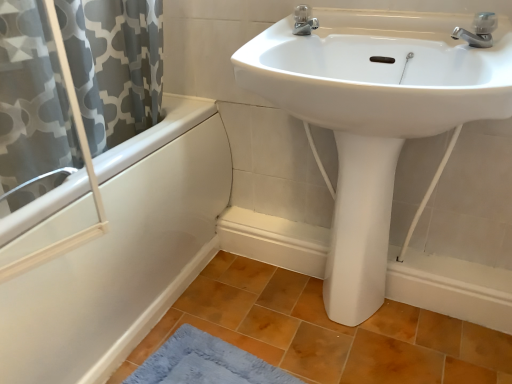
Question: Considering the positions of silver metallic faucet at upper right, which ranks as the 1th tap in front-to-back order, and silver metallic faucet at upper center, placed as the 2th tap when sorted from front to back, in the image, is silver metallic faucet at upper right, which ranks as the 1th tap in front-to-back order, bigger or smaller than silver metallic faucet at upper center, placed as the 2th tap when sorted from front to back,?

Choices:
 (A) big
 (B) small

Answer: (A)

Question: Relative to silver metallic faucet at upper center, the 1th tap when ordered from back to front, is silver metallic faucet at upper right, which ranks as the 1th tap in front-to-back order, in front or behind?

Choices:
 (A) behind
 (B) front

Answer: (B)

Question: Based on their relative distances, which object is nearer to the silver metallic faucet at upper center, marked as the 1th tap in a left-to-right arrangement?

Choices:
 (A) white glossy pedestal at center
 (B) white glossy sink at upper center
 (C) white glossy bathtub at left
 (D) brown matte tile at lower center
 (E) blue plush bath mat at lower left

Answer: (B)

Question: Based on their relative distances, which object is nearer to the blue plush bath mat at lower left?

Choices:
 (A) white glossy pedestal at center
 (B) white glossy bathtub at left
 (C) silver metallic faucet at upper right, which is counted as the first tap, starting from the right
 (D) white glossy sink at upper center
 (E) brown matte tile at lower center

Answer: (E)